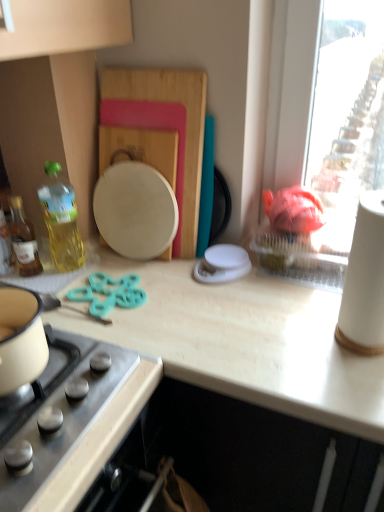
Where is `vacant point to the right of translucent yellow bottle at left, the 2th bottle positioned from the right`? vacant point to the right of translucent yellow bottle at left, the 2th bottle positioned from the right is located at coordinates (104, 280).